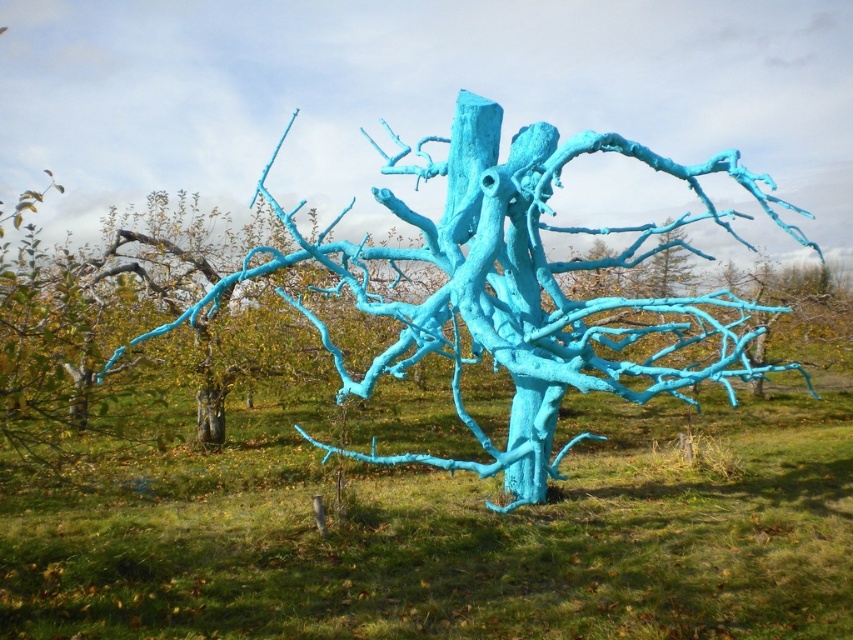
You are an artist planning to paint a landscape featuring the matte blue tree at center and the turquoise painted tree at center. Based on their positions, which tree should you paint first to ensure proper layering?

The matte blue tree at center should be painted first because it is located below the turquoise painted tree at center, allowing the upper tree to be layered on top afterward.

You are standing in the grassy area near the turquoise tree sculpture. You see two points marked in the image. Which point is closer to you, point (828, 486) or point (755, 337)?

Point (828, 486) is closer to the viewer than point (755, 337).

You are a landscape photographer planning to capture the matte blue tree at center and the turquoise painted tree at center in a single shot. Given their positions, which tree should you focus on first to ensure both are in clear view?

Since the turquoise painted tree at center is behind the matte blue tree at center, you should focus on the matte blue tree at center first to ensure both are in clear view.